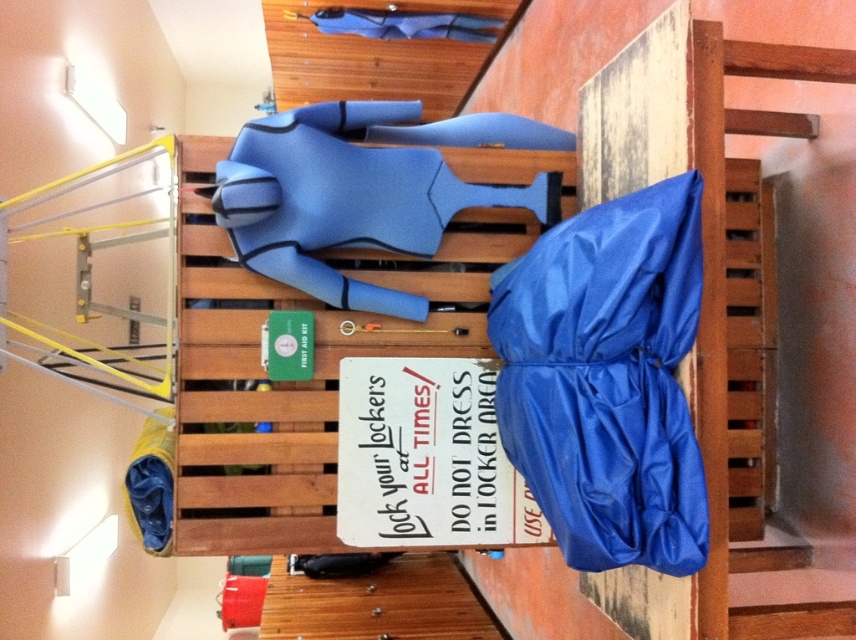
You are organizing the items on the bench and need to place both the blue nylon bag at right and the blue rubber wetsuit at center. Given their sizes, which item should you move to free up more space?

The blue nylon bag at right occupies less space than the blue rubber wetsuit at center, so you should move the blue nylon bag at right to free up more space.

You are organizing items on the bench and need to stack the blue nylon bag at right and the blue rubber wetsuit at center. Which item should go on the bottom to save space?

The blue nylon bag at right is thinner than the blue rubber wetsuit at center, so placing the blue nylon bag at right on the bottom and the blue rubber wetsuit at center on top would save space by utilizing vertical stacking efficiently.